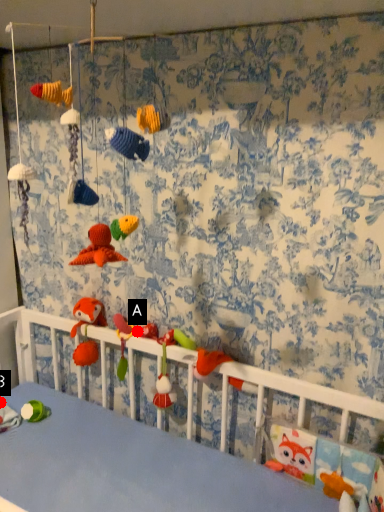
Question: Two points are circled on the image, labeled by A and B beside each circle. Which of the following is the closest to the observer?

Choices:
 (A) A is closer
 (B) B is closer

Answer: (A)